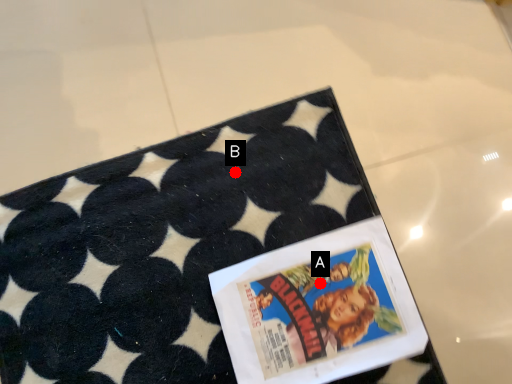
Question: Two points are circled on the image, labeled by A and B beside each circle. Which point appears farthest from the camera in this image?

Choices:
 (A) A is further
 (B) B is further

Answer: (B)